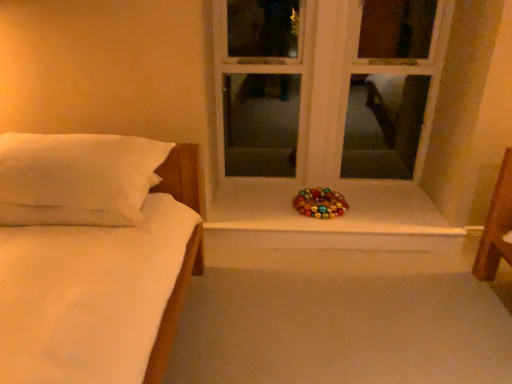
Question: Considering the positions of white wood window at center and white soft pillow at left in the image, is white wood window at center bigger or smaller than white soft pillow at left?

Choices:
 (A) small
 (B) big

Answer: (B)

Question: Is point (232, 16) positioned closer to the camera than point (89, 137)?

Choices:
 (A) farther
 (B) closer

Answer: (A)

Question: Which object is the farthest from the metallic shiny wreath at center?

Choices:
 (A) white soft pillow at left
 (B) white wood window at center

Answer: (A)

Question: Estimate the real-world distances between objects in this image. Which object is closer to the white wood window at center?

Choices:
 (A) white soft pillow at left
 (B) metallic shiny wreath at center

Answer: (B)